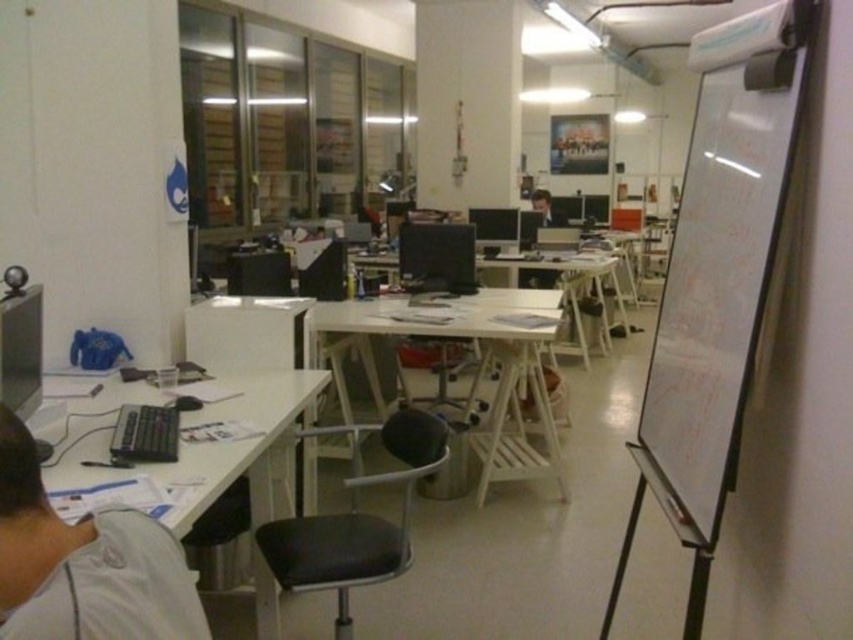
Is white plastic table at center smaller than matte black monitor at center?

No, white plastic table at center is not smaller than matte black monitor at center.

What are the coordinates of `white plastic table at center` in the screenshot? It's located at (567, 291).

You are a GUI agent. You are given a task and a screenshot of the screen. Output one action in this format:
    pyautogui.click(x=<x>, y=<y>)
    Task: Click on the white plastic table at center
    
    Given the screenshot: What is the action you would take?
    pyautogui.click(x=567, y=291)

Can you confirm if white wood computer desk at center is positioned above matte black monitor at center?

Actually, white wood computer desk at center is below matte black monitor at center.

From the picture: Is white wood computer desk at center shorter than matte black monitor at center?

Incorrect, white wood computer desk at center's height does not fall short of matte black monitor at center's.

Does point (495, 292) come farther from viewer compared to point (538, 200)?

That is False.

In order to click on white wood computer desk at center in this screenshot , I will do `click(480, 365)`.

Which of these two, gray fabric shirt at lower left or white wood computer desk at center, stands shorter?

Standing shorter between the two is gray fabric shirt at lower left.

Is gray fabric shirt at lower left thinner than white wood computer desk at center?

Indeed, gray fabric shirt at lower left has a lesser width compared to white wood computer desk at center.

Is point (96, 520) positioned in front of point (529, 310)?

Yes, point (96, 520) is closer to viewer.

Where is `gray fabric shirt at lower left`? This screenshot has height=640, width=853. gray fabric shirt at lower left is located at coordinates (84, 563).